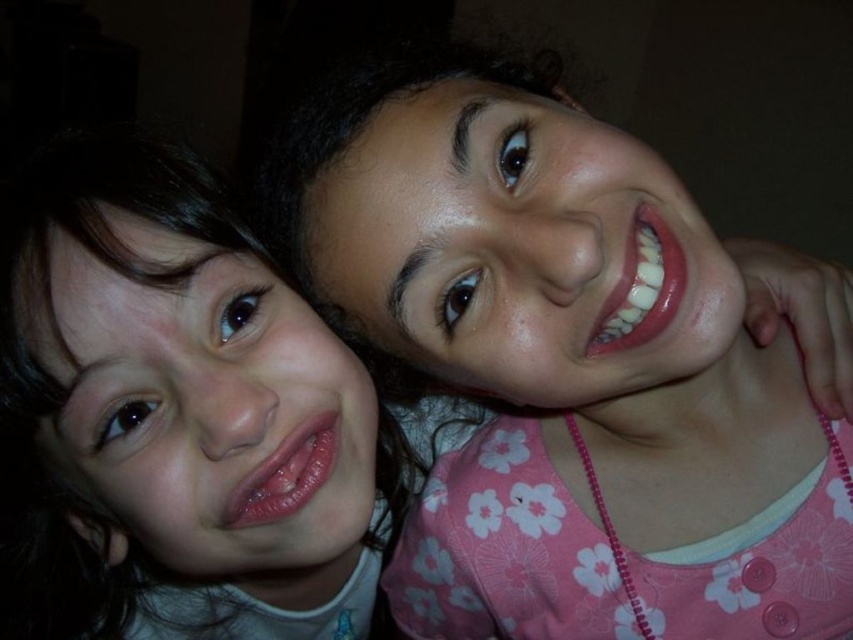
Who is positioned more to the left, pink floral dress at upper right or smooth skin face at upper left?

From the viewer's perspective, smooth skin face at upper left appears more on the left side.

Is the position of pink floral dress at upper right less distant than that of smooth skin face at upper left?

Yes.

Is point (396, 176) more distant than point (369, 502)?

No, (396, 176) is closer to viewer.

Where is `pink floral dress at upper right`? Image resolution: width=853 pixels, height=640 pixels. pink floral dress at upper right is located at coordinates point(560,362).